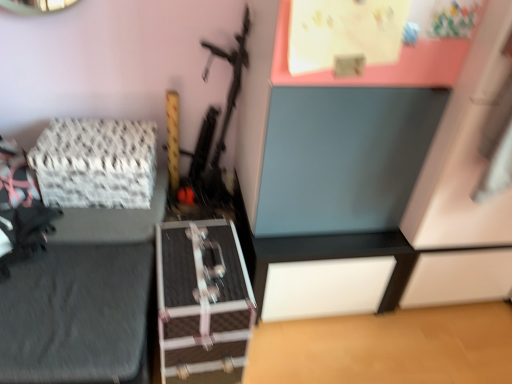
Question: Can you confirm if white woven fabric at left is shorter than matte blue drawer at upper center?

Choices:
 (A) yes
 (B) no

Answer: (A)

Question: Are white woven fabric at left and matte blue drawer at upper center making contact?

Choices:
 (A) yes
 (B) no

Answer: (B)

Question: From the image's perspective, is white woven fabric at left located above matte blue drawer at upper center?

Choices:
 (A) yes
 (B) no

Answer: (B)

Question: Would you say white woven fabric at left contains matte blue drawer at upper center?

Choices:
 (A) yes
 (B) no

Answer: (B)

Question: Is white woven fabric at left outside matte blue drawer at upper center?

Choices:
 (A) no
 (B) yes

Answer: (B)

Question: Can you confirm if white woven fabric at left is wider than matte blue drawer at upper center?

Choices:
 (A) yes
 (B) no

Answer: (B)

Question: Is white woven fabric at left surrounded by matte blue drawer at upper center?

Choices:
 (A) yes
 (B) no

Answer: (B)

Question: Does matte blue drawer at upper center appear on the left side of white woven fabric at left?

Choices:
 (A) yes
 (B) no

Answer: (B)

Question: Considering the relative sizes of matte blue drawer at upper center and white woven fabric at left in the image provided, is matte blue drawer at upper center thinner than white woven fabric at left?

Choices:
 (A) no
 (B) yes

Answer: (A)

Question: Can you confirm if matte blue drawer at upper center is positioned to the right of white woven fabric at left?

Choices:
 (A) no
 (B) yes

Answer: (B)

Question: From the image's perspective, is matte blue drawer at upper center located beneath white woven fabric at left?

Choices:
 (A) yes
 (B) no

Answer: (B)

Question: From a real-world perspective, is matte blue drawer at upper center located higher than white woven fabric at left?

Choices:
 (A) yes
 (B) no

Answer: (A)

Question: From the image's perspective, is matte blue drawer at upper center located above or below white woven fabric at left?

Choices:
 (A) below
 (B) above

Answer: (B)